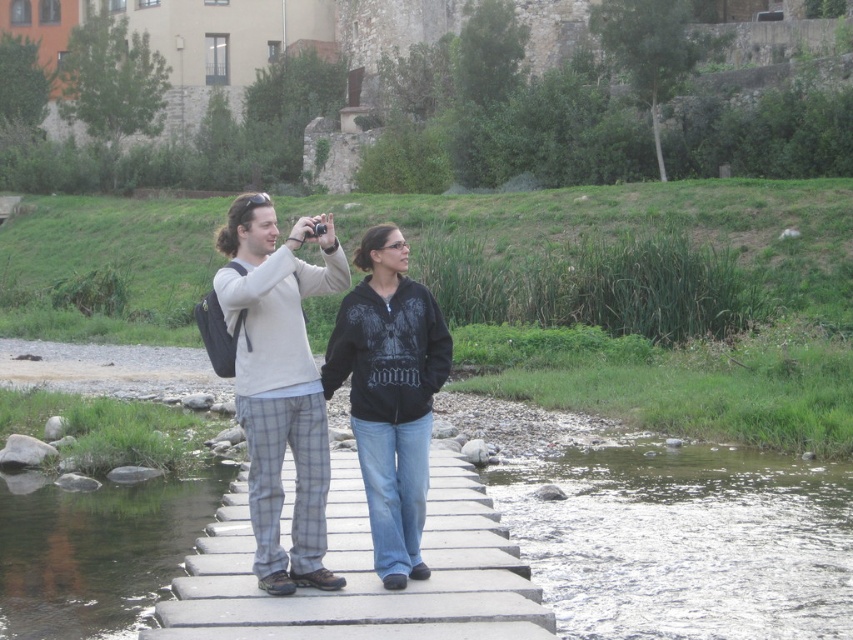
What do you see at coordinates (280, 381) in the screenshot? Image resolution: width=853 pixels, height=640 pixels. I see `light gray flannel pants at center` at bounding box center [280, 381].

Can you confirm if light gray flannel pants at center is thinner than black zip-up jacket at center?

Incorrect, light gray flannel pants at center's width is not less than black zip-up jacket at center's.

Is point (244, 291) positioned in front of point (424, 497)?

Yes, point (244, 291) is closer to viewer.

Where is `light gray flannel pants at center`? This screenshot has width=853, height=640. light gray flannel pants at center is located at coordinates (280, 381).